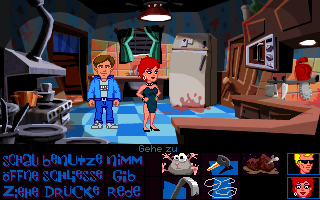
I want to click on door, so click(241, 69).